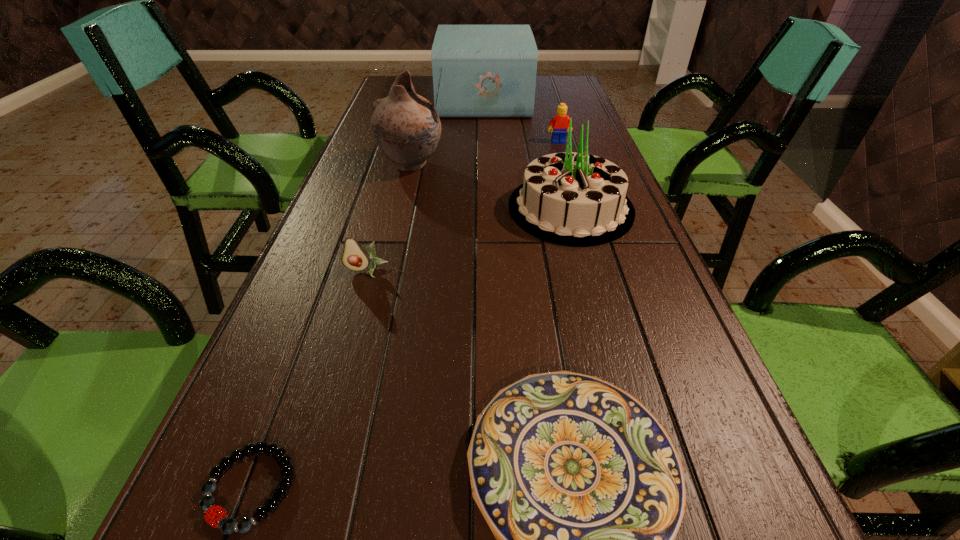
In order to click on free space between the pottery and the Lego in this screenshot , I will do `click(485, 153)`.

Where is `free space between the radio receiver and the fourth tallest object`? free space between the radio receiver and the fourth tallest object is located at coordinates (521, 121).

Where is `unoccupied area between the farthest object and the bracelet`? unoccupied area between the farthest object and the bracelet is located at coordinates (367, 294).

At what (x,y) coordinates should I click in order to perform the action: click on vacant point located between the pottery and the bracelet. Please return your answer as a coordinate pair (x, y). Looking at the image, I should click on (330, 326).

Locate an element on the screen. free point between the third nearest object and the pottery is located at coordinates (389, 218).

This screenshot has width=960, height=540. Find the location of `object that ranks as the second closest to the second shortest object`. object that ranks as the second closest to the second shortest object is located at coordinates (354, 257).

Identify which object is located as the fifth nearest to the sixth tallest object. Please provide its 2D coordinates. Your answer should be formatted as a tuple, i.e. [(x, y)], where the tuple contains the x and y coordinates of a point satisfying the conditions above.

[(560, 122)]

At what (x,y) coordinates should I click in order to perform the action: click on free spot that satisfies the following two spatial constraints: 1. on the front panel of the farthest object; 2. on the seed side of the fifth farthest object. Please return your answer as a coordinate pair (x, y). The image size is (960, 540). Looking at the image, I should click on (486, 271).

You are a GUI agent. You are given a task and a screenshot of the screen. Output one action in this format:
    pyautogui.click(x=<x>, y=<y>)
    Task: Click on the blank space that satisfies the following two spatial constraints: 1. on the face of the second farthest object; 2. from the spout of the pottery
    
    Given the screenshot: What is the action you would take?
    (x=565, y=165)

Image resolution: width=960 pixels, height=540 pixels. Find the location of `free spot that satisfies the following two spatial constraints: 1. from the spout of the pottery; 2. on the seed side of the avocado`. free spot that satisfies the following two spatial constraints: 1. from the spout of the pottery; 2. on the seed side of the avocado is located at coordinates (385, 271).